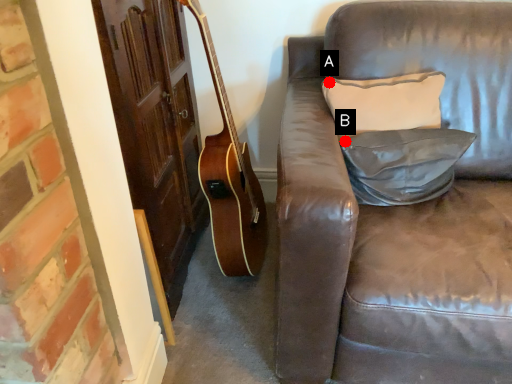
Question: Two points are circled on the image, labeled by A and B beside each circle. Which of the following is the farthest from the observer?

Choices:
 (A) A is further
 (B) B is further

Answer: (A)